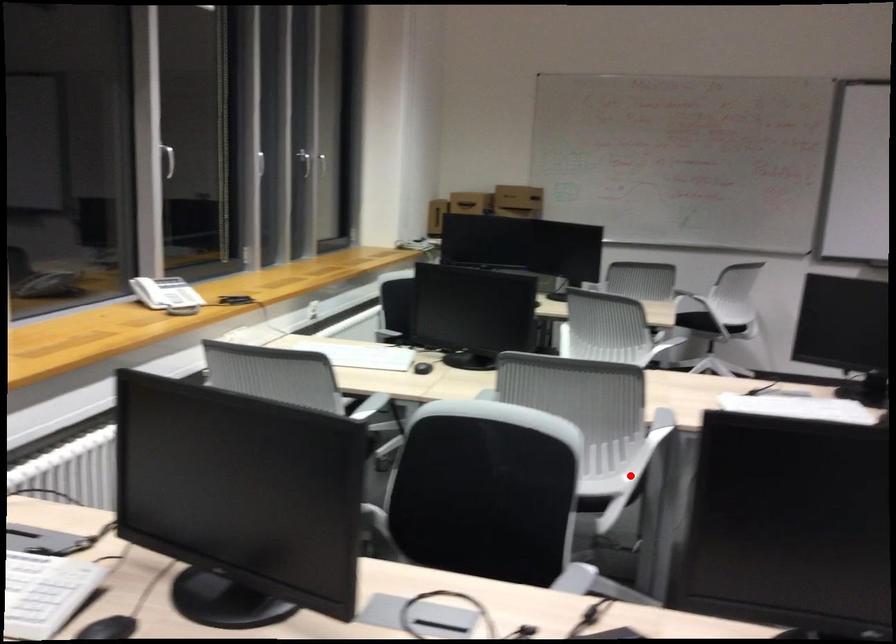
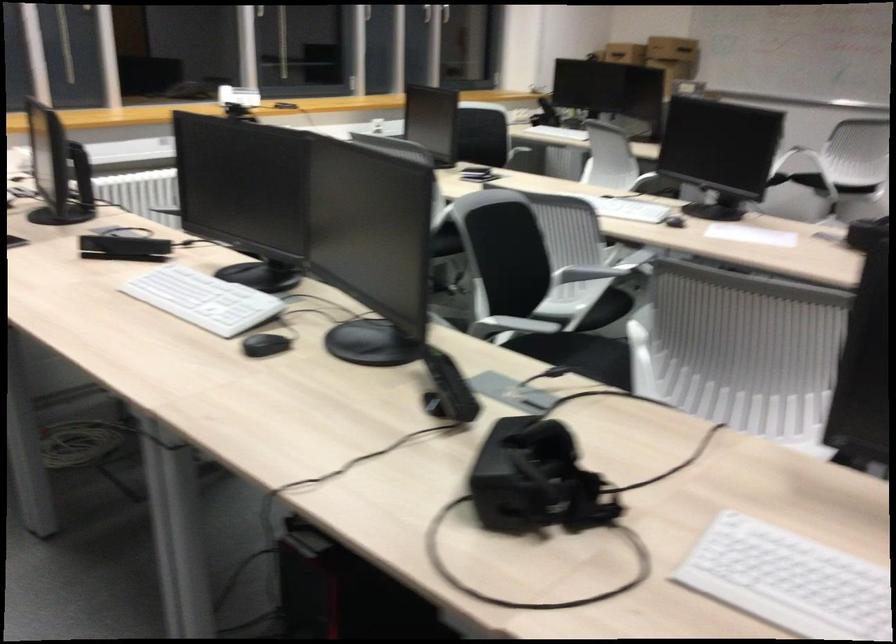
The point at the highlighted location is marked in the first image. Where is the corresponding point in the second image?

(445, 242)